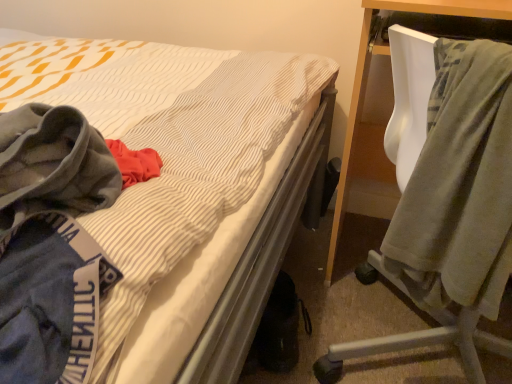
Question: Choose the correct answer: Is velvet green blanket at right inside gray fleece hoodie at left or outside it?

Choices:
 (A) inside
 (B) outside

Answer: (B)

Question: Considering their positions, is velvet green blanket at right located in front of or behind gray fleece hoodie at left?

Choices:
 (A) front
 (B) behind

Answer: (B)

Question: Based on their positions, is velvet green blanket at right located to the left or right of gray fleece hoodie at left?

Choices:
 (A) right
 (B) left

Answer: (A)

Question: Is gray fleece hoodie at left spatially inside velvet green blanket at right, or outside of it?

Choices:
 (A) outside
 (B) inside

Answer: (A)

Question: Is gray fleece hoodie at left in front of or behind velvet green blanket at right in the image?

Choices:
 (A) front
 (B) behind

Answer: (A)

Question: Considering the relative positions of gray fleece hoodie at left and velvet green blanket at right in the image provided, is gray fleece hoodie at left to the left or to the right of velvet green blanket at right?

Choices:
 (A) left
 (B) right

Answer: (A)

Question: Considering the positions of gray fleece hoodie at left and velvet green blanket at right in the image, is gray fleece hoodie at left taller or shorter than velvet green blanket at right?

Choices:
 (A) tall
 (B) short

Answer: (B)